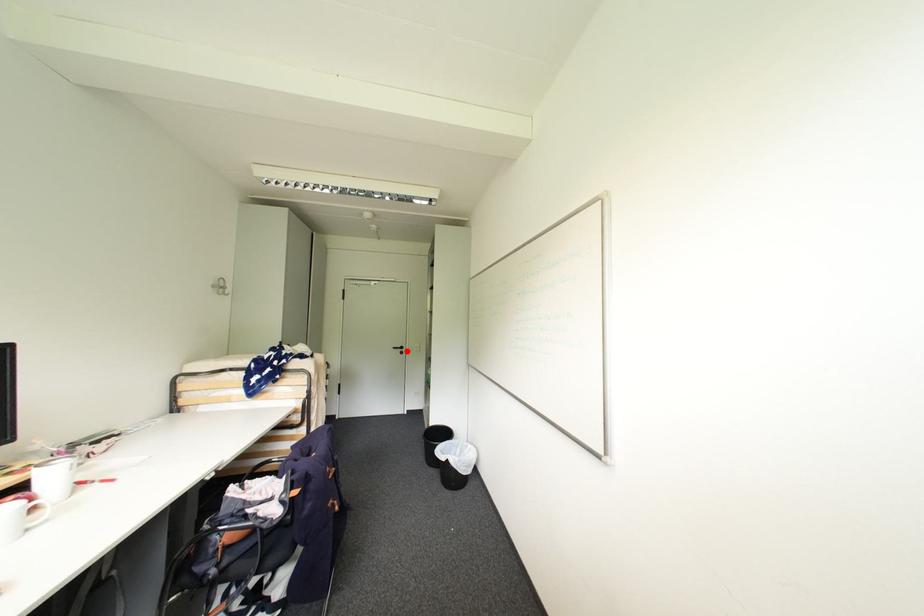
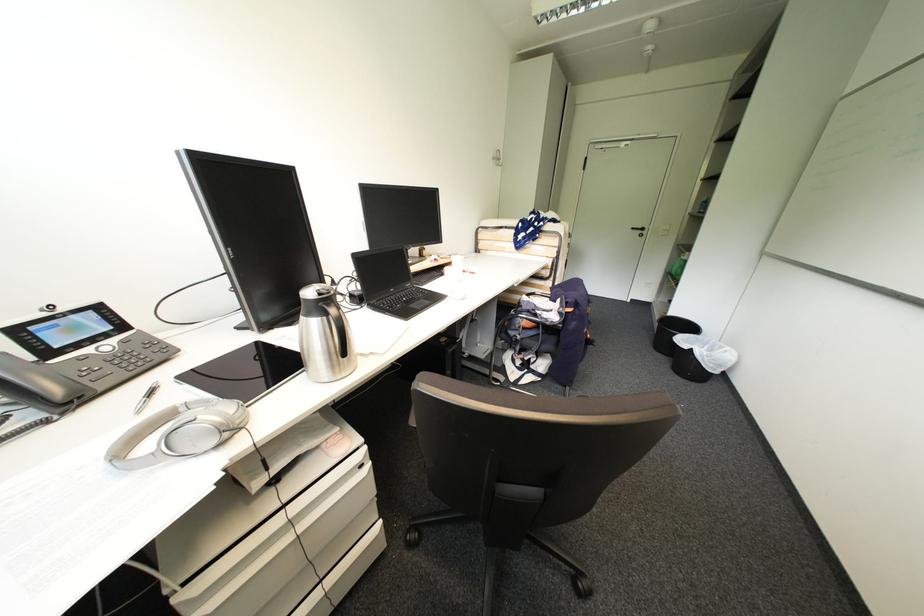
Question: I am providing you with two images of the same scene from different viewpoints. Given a red point in image1, look at the same physical point in image2. Is it:

Choices:
 (A) Closer to the viewpoint
 (B) Farther from the viewpoint

Answer: (A)